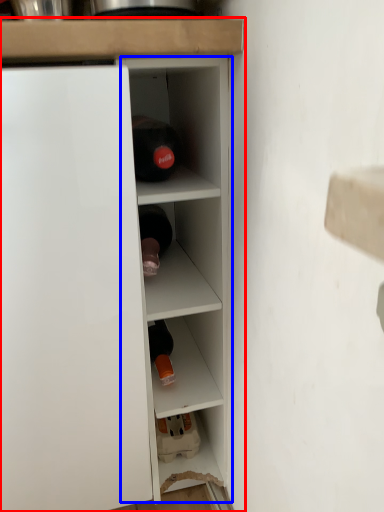
Question: Which object appears farthest to the camera in this image, cupboard (highlighted by a red box) or cabinet (highlighted by a blue box)?

Choices:
 (A) cupboard
 (B) cabinet

Answer: (B)